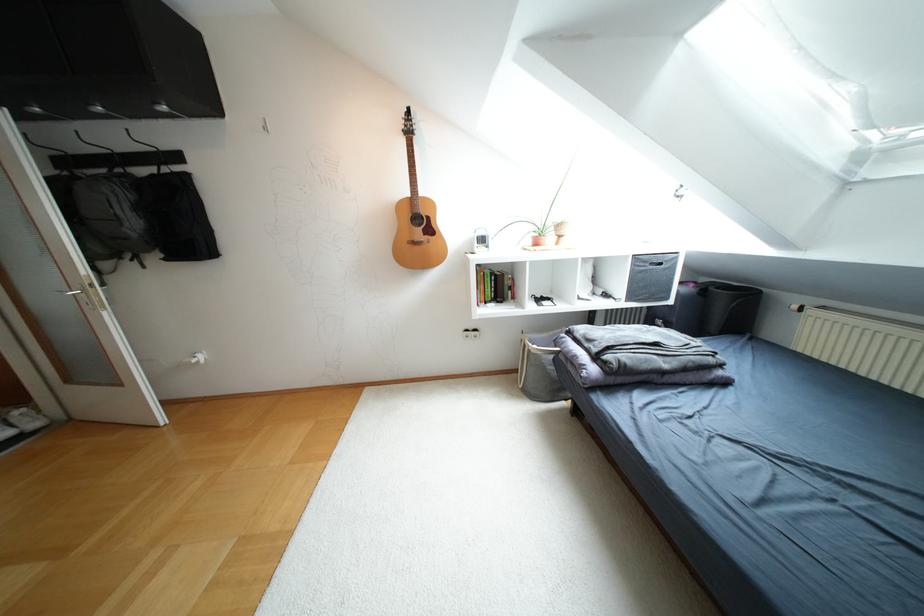
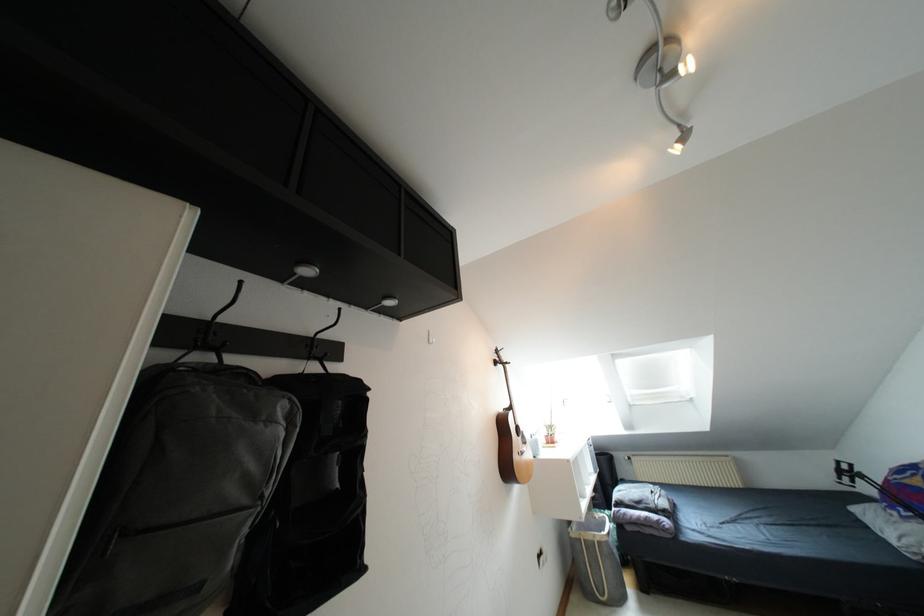
Where in the second image is the point corresponding to point (164, 108) from the first image?

(388, 302)